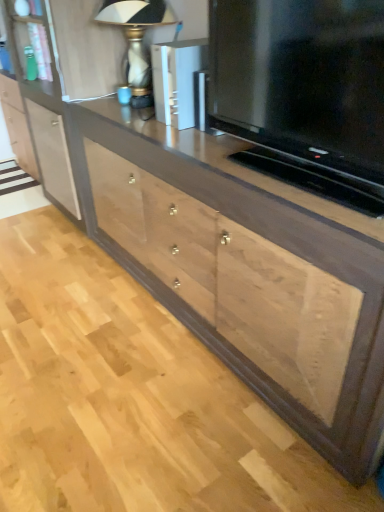
Measure the distance between metallic silver speaker at upper center and camera.

4.87 feet.

Find the location of a particular element. matte black television at center is located at coordinates (304, 85).

Find the location of `matte glass table lamp at upper center`. matte glass table lamp at upper center is located at coordinates (137, 38).

This screenshot has height=512, width=384. In order to click on metallic silver speaker at upper center in this screenshot , I will do `click(178, 81)`.

Locate an element on the screen. This screenshot has height=512, width=384. appliance on the left of matte black television at center is located at coordinates (178, 81).

Can you confirm if matte black television at center is wider than metallic silver speaker at upper center?

In fact, matte black television at center might be narrower than metallic silver speaker at upper center.

Can you tell me how much matte black television at center and metallic silver speaker at upper center differ in facing direction?

0.115 degrees.

Is matte black television at center to the right of metallic silver speaker at upper center from the viewer's perspective?

Yes.

From a real-world perspective, is metallic silver speaker at upper center positioned over matte glass table lamp at upper center based on gravity?

Incorrect, from a real-world perspective, metallic silver speaker at upper center is lower than matte glass table lamp at upper center.

Who is smaller, metallic silver speaker at upper center or matte glass table lamp at upper center?

metallic silver speaker at upper center.

Based on the photo, considering the sizes of objects metallic silver speaker at upper center and matte glass table lamp at upper center in the image provided, who is shorter, metallic silver speaker at upper center or matte glass table lamp at upper center?

Standing shorter between the two is metallic silver speaker at upper center.

How different are the orientations of matte glass table lamp at upper center and matte black television at center in degrees?

0.456 degrees separate the facing orientations of matte glass table lamp at upper center and matte black television at center.

From a real-world perspective, is matte glass table lamp at upper center positioned above or below matte black television at center?

In terms of real-world spatial position, matte glass table lamp at upper center is below matte black television at center.

Which is more to the right, matte glass table lamp at upper center or matte black television at center?

Positioned to the right is matte black television at center.

Is metallic silver speaker at upper center not inside natural wood drawer at center?

Indeed, metallic silver speaker at upper center is completely outside natural wood drawer at center.

Identify the location of drawer on the right side of metallic silver speaker at upper center. The image size is (384, 512). (233, 279).

Which is more to the right, metallic silver speaker at upper center or natural wood drawer at center?

natural wood drawer at center.

Who is more distant, natural wood drawer at center or metallic silver speaker at upper center?

metallic silver speaker at upper center is behind.

From the image's perspective, which is below, natural wood drawer at center or metallic silver speaker at upper center?

natural wood drawer at center.

Are natural wood drawer at center and metallic silver speaker at upper center located far from each other?

That's not correct — natural wood drawer at center is a little close to metallic silver speaker at upper center.

Does natural wood drawer at center turn towards metallic silver speaker at upper center?

No, natural wood drawer at center is not oriented towards metallic silver speaker at upper center.

I want to click on table lamp behind the natural wood drawer at center, so click(x=137, y=38).

From the picture: Which is more to the right, matte glass table lamp at upper center or natural wood drawer at center?

From the viewer's perspective, natural wood drawer at center appears more on the right side.

From the image's perspective, is matte glass table lamp at upper center above or below natural wood drawer at center?

matte glass table lamp at upper center is situated higher than natural wood drawer at center in the image.

Based on their sizes in the image, would you say natural wood drawer at center is bigger or smaller than matte glass table lamp at upper center?

Considering their sizes, natural wood drawer at center takes up more space than matte glass table lamp at upper center.

Is natural wood drawer at center not inside matte glass table lamp at upper center?

That's correct, natural wood drawer at center is outside of matte glass table lamp at upper center.

Which of these two, natural wood drawer at center or matte glass table lamp at upper center, stands shorter?

matte glass table lamp at upper center.

Consider the image. Between natural wood drawer at center and matte glass table lamp at upper center, which one has larger width?

natural wood drawer at center.

At what (x,y) coordinates should I click in order to perform the action: click on television on the right of metallic silver speaker at upper center. Please return your answer as a coordinate pair (x, y). This screenshot has height=512, width=384. Looking at the image, I should click on (304, 85).

Where is `table lamp that appears above the metallic silver speaker at upper center (from the image's perspective)`? Image resolution: width=384 pixels, height=512 pixels. table lamp that appears above the metallic silver speaker at upper center (from the image's perspective) is located at coordinates (137, 38).

Looking at this image, considering their positions, is matte black television at center positioned further to matte glass table lamp at upper center than metallic silver speaker at upper center?

Based on the image, matte black television at center appears to be further to matte glass table lamp at upper center.

Based on their spatial positions, is matte black television at center or natural wood drawer at center closer to matte glass table lamp at upper center?

Based on the image, natural wood drawer at center appears to be nearer to matte glass table lamp at upper center.

From the image, which object appears to be farther from metallic silver speaker at upper center, matte glass table lamp at upper center or matte black television at center?

Answer: matte black television at center is positioned further to the anchor metallic silver speaker at upper center.

Based on their spatial positions, is matte black television at center or matte glass table lamp at upper center further from natural wood drawer at center?

matte glass table lamp at upper center lies further to natural wood drawer at center than the other object.

Based on their spatial positions, is natural wood drawer at center or matte black television at center closer to metallic silver speaker at upper center?

matte black television at center is positioned closer to the anchor metallic silver speaker at upper center.

From the picture: Considering their positions, is matte black television at center positioned further to metallic silver speaker at upper center than matte glass table lamp at upper center?

The object further to metallic silver speaker at upper center is matte black television at center.

In the scene shown: From the image, which object appears to be nearer to matte black television at center, natural wood drawer at center or metallic silver speaker at upper center?

Among the two, metallic silver speaker at upper center is located nearer to matte black television at center.

In the scene shown: Based on their spatial positions, is natural wood drawer at center or matte glass table lamp at upper center closer to metallic silver speaker at upper center?

Based on the image, matte glass table lamp at upper center appears to be nearer to metallic silver speaker at upper center.

The image size is (384, 512). In order to click on drawer between matte black television at center and matte glass table lamp at upper center from front to back in this screenshot , I will do `click(233, 279)`.

The width and height of the screenshot is (384, 512). In order to click on appliance between matte black television at center and matte glass table lamp at upper center in the front-back direction in this screenshot , I will do `click(178, 81)`.

Locate an element on the screen. drawer located between matte black television at center and metallic silver speaker at upper center in the depth direction is located at coordinates (233, 279).

Find the location of `appliance positioned between natural wood drawer at center and matte glass table lamp at upper center from near to far`. appliance positioned between natural wood drawer at center and matte glass table lamp at upper center from near to far is located at coordinates (178, 81).